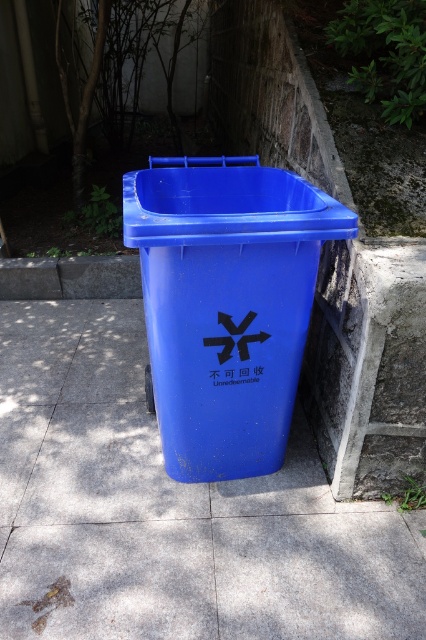
You are standing at the point marked by coordinates (170,509). Based on the scene description, what object are you directly at?

The point marked by coordinates (170,509) is directly at the blue plastic trash can at center.

You are standing at the recycling bin and want to walk to a point behind the bin. Which of the two points, point (36, 422) or point (140, 198), is located behind the recycling bin?

Point (36, 422) is behind point (140, 198), so it is the point located behind the recycling bin.